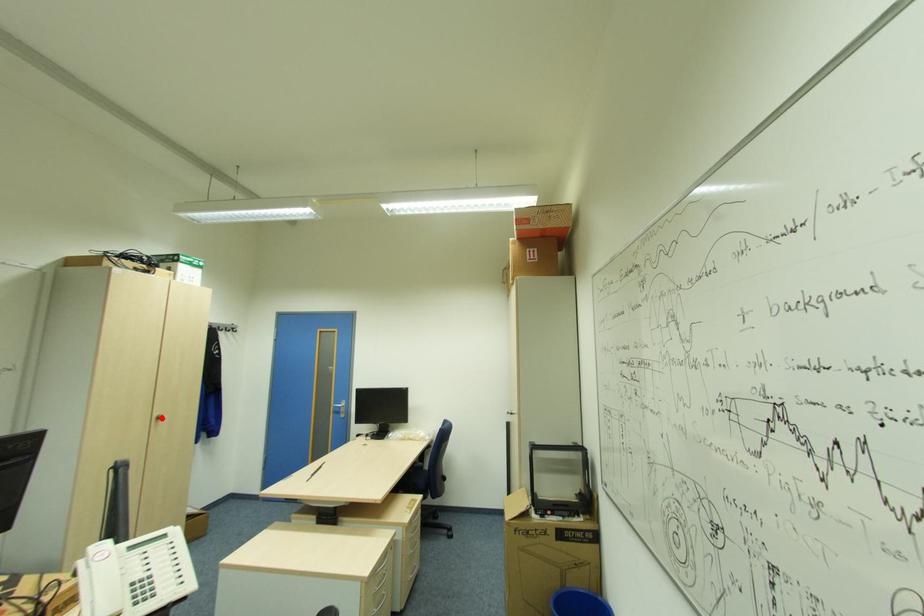
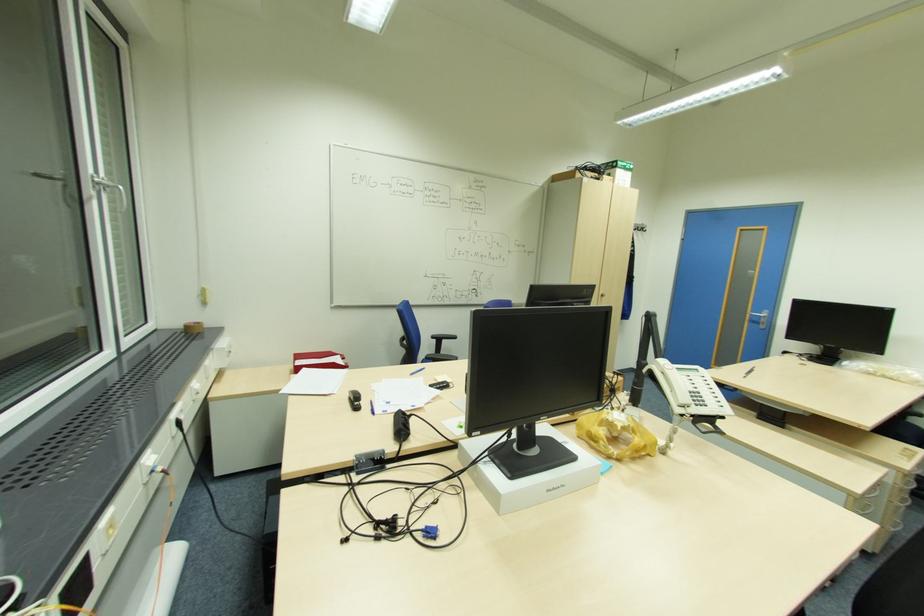
In the second image, find the point that corresponds to the highlighted location in the first image.

(604, 294)